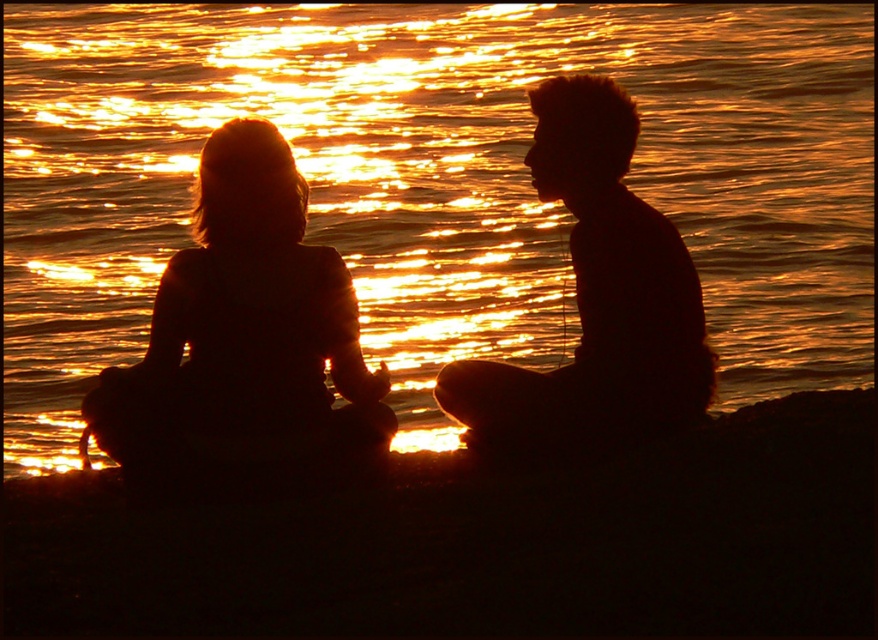
Question: Can you confirm if golden reflective water at center is smaller than silhouette man at center?

Choices:
 (A) no
 (B) yes

Answer: (A)

Question: Which point is closer to the camera?

Choices:
 (A) golden reflective water at center
 (B) silhouette hair at left
 (C) silhouette man at center

Answer: (B)

Question: Does golden reflective water at center have a greater width compared to silhouette hair at left?

Choices:
 (A) no
 (B) yes

Answer: (B)

Question: Based on their relative distances, which object is farther from the silhouette hair at left?

Choices:
 (A) silhouette man at center
 (B) golden reflective water at center

Answer: (B)

Question: Can you confirm if silhouette hair at left is positioned below silhouette man at center?

Choices:
 (A) yes
 (B) no

Answer: (A)

Question: Which of the following is the closest to the observer?

Choices:
 (A) (544, 198)
 (B) (180, 339)

Answer: (B)